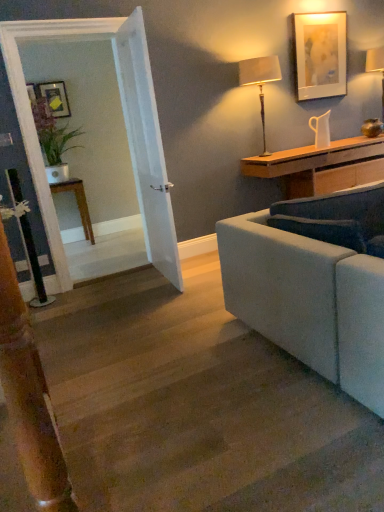
Where is `vacant point to the left of white wooden door at left`? The image size is (384, 512). vacant point to the left of white wooden door at left is located at coordinates (128, 288).